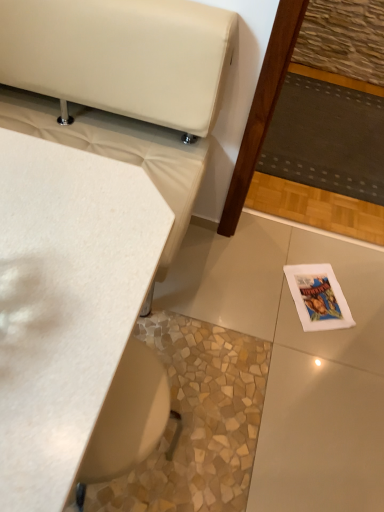
Question: From a real-world perspective, is white paper magazine at lower right physically located above or below dark gray fabric mat at center right?

Choices:
 (A) below
 (B) above

Answer: (A)

Question: Visually, is white paper magazine at lower right positioned to the left or to the right of dark gray fabric mat at center right?

Choices:
 (A) right
 (B) left

Answer: (B)

Question: Which object is the closest to the white matte table at upper left?

Choices:
 (A) white paper magazine at lower right
 (B) dark gray fabric mat at center right

Answer: (A)

Question: Which object is positioned closest to the dark gray fabric mat at center right?

Choices:
 (A) white matte table at upper left
 (B) white paper magazine at lower right

Answer: (B)